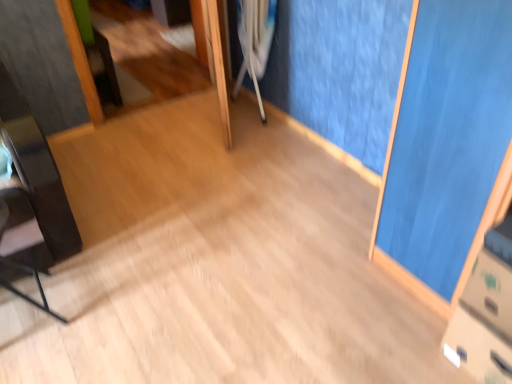
Where is `unoccupied area behind matte black chair at left`? This screenshot has width=512, height=384. unoccupied area behind matte black chair at left is located at coordinates (61, 272).